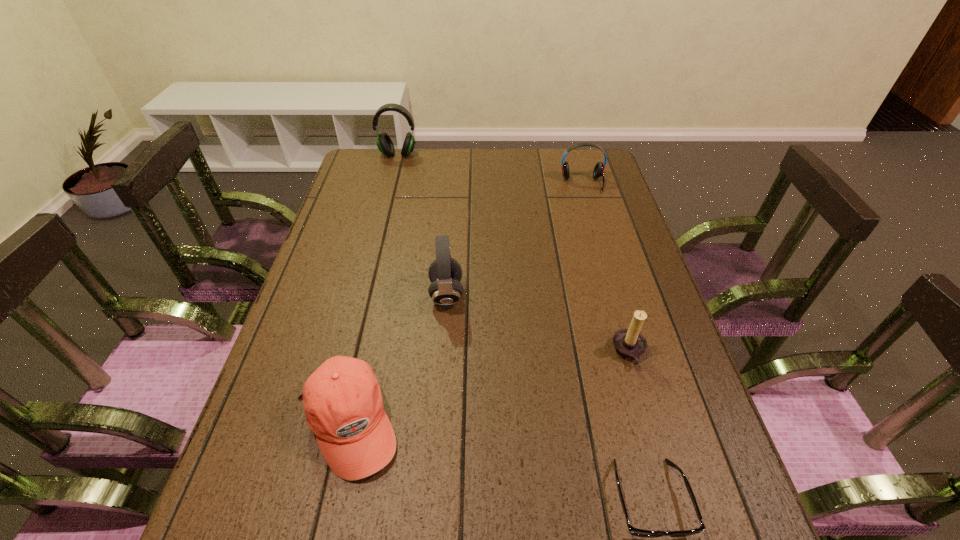
Image resolution: width=960 pixels, height=540 pixels. Identify the location of object situated at the far right corner. click(598, 171).

Find the location of a particular element. The height and width of the screenshot is (540, 960). vacant region at the far edge of the desktop is located at coordinates (516, 163).

Find the location of a particular element. This screenshot has width=960, height=540. free space at the left edge of the desktop is located at coordinates (319, 361).

Image resolution: width=960 pixels, height=540 pixels. What are the coordinates of `vacant space at the right edge of the desktop` in the screenshot? It's located at (679, 475).

Image resolution: width=960 pixels, height=540 pixels. Identify the location of blank region between the third nearest object and the leftmost headset. (514, 253).

At what (x,y) coordinates should I click in order to perform the action: click on unoccupied area between the baseball cap and the farthest headset. Please return your answer as a coordinate pair (x, y). Looking at the image, I should click on (373, 289).

Locate an element on the screen. The height and width of the screenshot is (540, 960). vacant space that is in between the third nearest object and the rightmost headset is located at coordinates (606, 268).

Locate an element on the screen. vacant space that is in between the third nearest object and the second headset from right to left is located at coordinates (538, 323).

Image resolution: width=960 pixels, height=540 pixels. Identify the location of free space between the farthest object and the fourth nearest object. (422, 224).

Identify the location of free space that is in between the nearest headset and the candle holder. (538, 323).